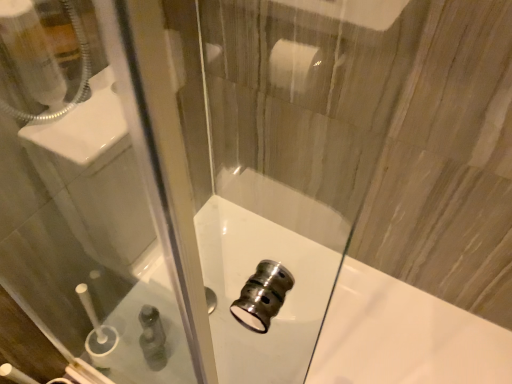
The height and width of the screenshot is (384, 512). What are the coordinates of `vacant area that is situated to the right of green plastic bottle at lower left` in the screenshot? It's located at click(212, 350).